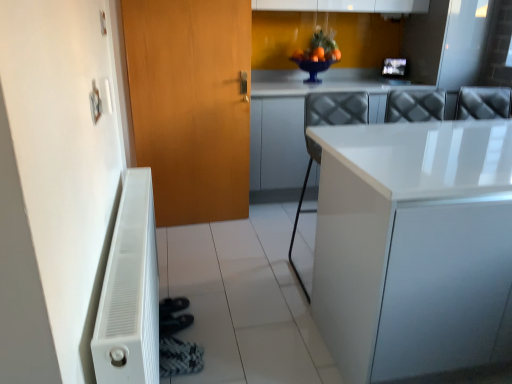
Locate an element on the screen. The width and height of the screenshot is (512, 384). free space in front of wooden door at left is located at coordinates (203, 241).